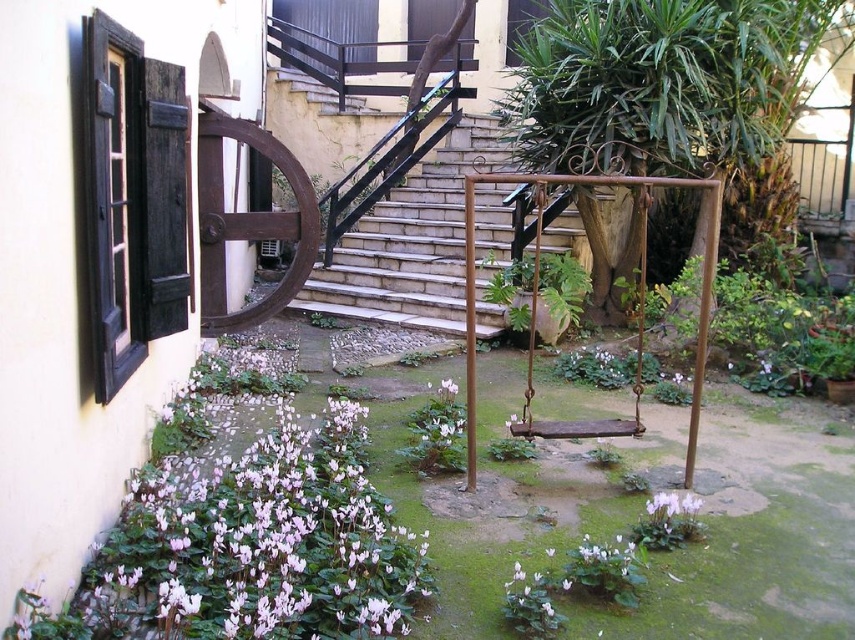
Is point (484, 244) positioned in front of point (541, 316)?

No, (484, 244) is further to viewer.

Is rustic metal stairs at center smaller than green leafy plant at center?

Actually, rustic metal stairs at center might be larger than green leafy plant at center.

You are a GUI agent. You are given a task and a screenshot of the screen. Output one action in this format:
    pyautogui.click(x=<x>, y=<y>)
    Task: Click on the rustic metal stairs at center
    Image resolution: width=855 pixels, height=640 pixels.
    Given the screenshot: What is the action you would take?
    pyautogui.click(x=410, y=243)

Is rustic metal stairs at center to the right of pink matte cyclamen at lower center from the viewer's perspective?

Yes, rustic metal stairs at center is to the right of pink matte cyclamen at lower center.

Based on the photo, who is more forward, [405,204] or [449,456]?

Point [449,456] is more forward.

Where is `rustic metal stairs at center`? The height and width of the screenshot is (640, 855). rustic metal stairs at center is located at coordinates (410, 243).

Between rusty wood swing at center and green leafy plant at center, which one has less height?

green leafy plant at center

Between point (618, 420) and point (559, 253), which one is positioned in front?

Point (618, 420) is more forward.

Identify the location of rusty wood swing at center. Image resolution: width=855 pixels, height=640 pixels. (640, 301).